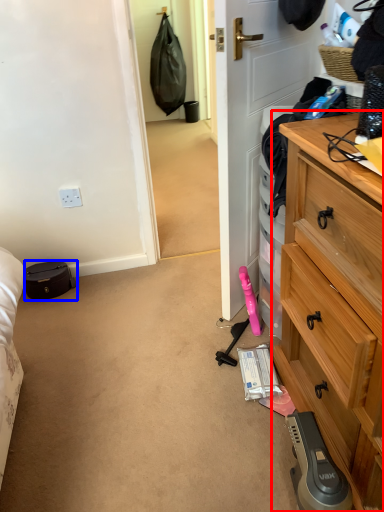
Question: Which of the following is the closest to the observer, chest of drawers (highlighted by a red box) or luggage and bags (highlighted by a blue box)?

Choices:
 (A) chest of drawers
 (B) luggage and bags

Answer: (A)